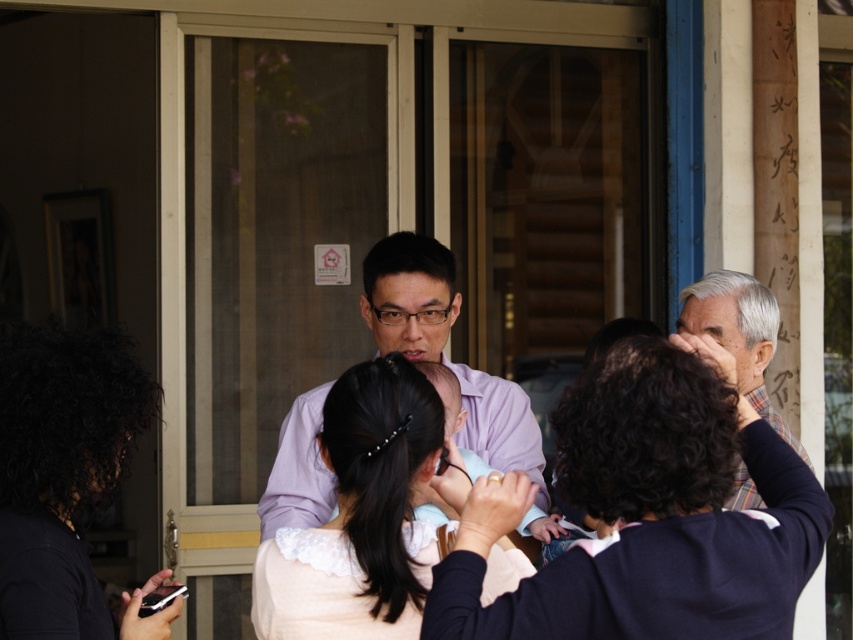
You are standing in front of the building with large glass doors and want to locate the person with dark brown hair at center. According to the coordinates provided, where would you look to find them?

The dark brown hair at center is located at the coordinates point (648,515), which would be in the lower right area of the image.

You are a photographer trying to capture a portrait of the person with the dark brown hair at center and the matte purple shirt at center. Since you want to focus on their face, which object should you zoom in on more to ensure it takes up more of the frame?

The dark brown hair at center has a smaller size compared to matte purple shirt at center, so you should zoom in more on the dark brown hair at center to make it larger in the frame.